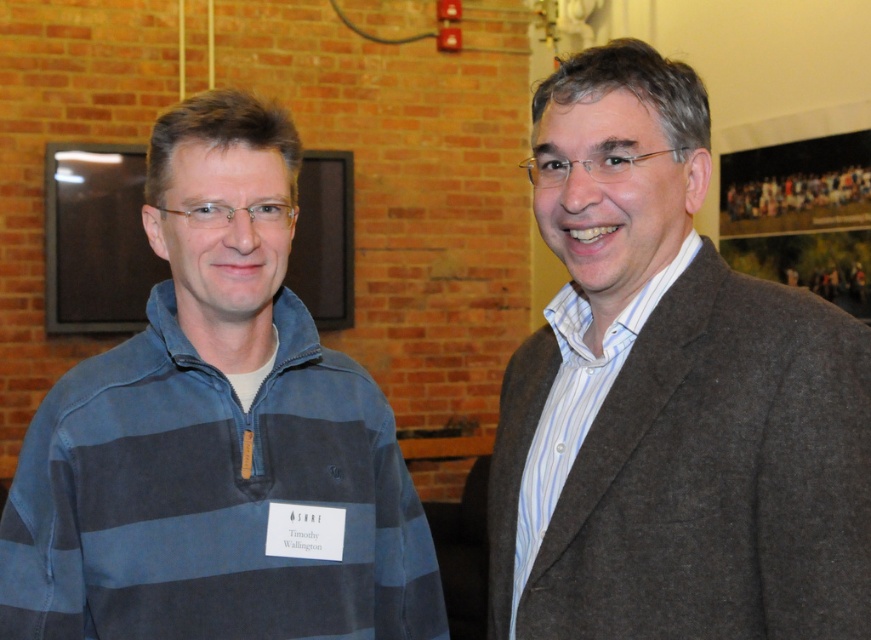
Question: Considering the relative positions of gray woolen blazer at right and blue striped sweater at left in the image provided, where is gray woolen blazer at right located with respect to blue striped sweater at left?

Choices:
 (A) right
 (B) left

Answer: (A)

Question: Considering the real-world distances, which object is farthest from the matte black monitor at upper left?

Choices:
 (A) gray woolen blazer at right
 (B) blue striped sweater at left

Answer: (A)

Question: Which point is farther to the camera?

Choices:
 (A) blue striped sweater at left
 (B) matte black monitor at upper left

Answer: (B)

Question: Does gray woolen blazer at right have a smaller size compared to matte black monitor at upper left?

Choices:
 (A) yes
 (B) no

Answer: (B)

Question: Can you confirm if gray woolen blazer at right is thinner than blue striped sweater at left?

Choices:
 (A) no
 (B) yes

Answer: (B)

Question: Which object is the closest to the blue striped sweater at left?

Choices:
 (A) gray woolen blazer at right
 (B) matte black monitor at upper left

Answer: (A)